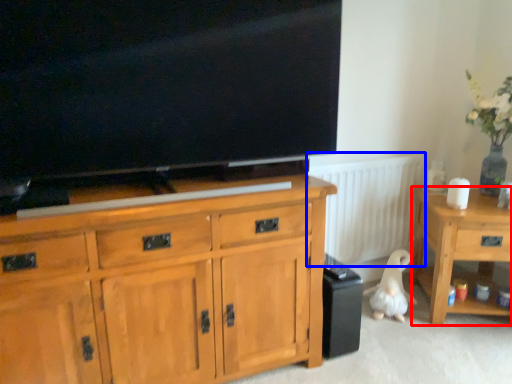
Question: Among these objects, which one is nearest to the camera, desk (highlighted by a red box) or radiator (highlighted by a blue box)?

Choices:
 (A) desk
 (B) radiator

Answer: (A)